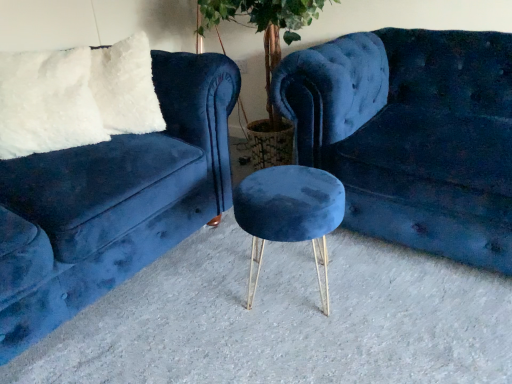
Find the location of a particular element. vacant space situated on the left part of velvet blue stool at center is located at coordinates (198, 288).